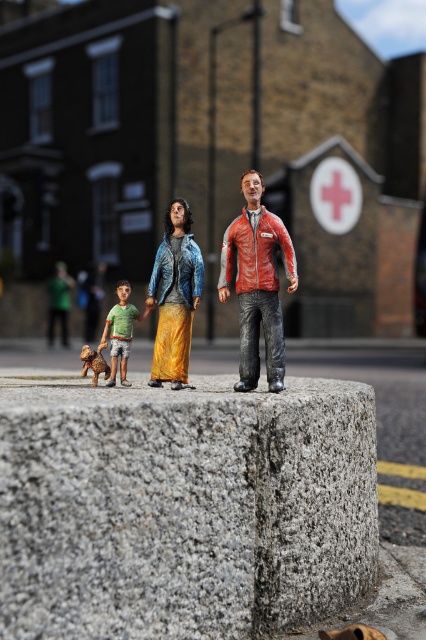
Question: Which object appears closest to the camera in this image?

Choices:
 (A) leather jacket at center
 (B) green cotton shirt at center

Answer: (A)

Question: Is leather jacket at center bigger than green cotton shirt at center?

Choices:
 (A) no
 (B) yes

Answer: (B)

Question: Does leather jacket at center have a lesser width compared to brown fur dog at lower left?

Choices:
 (A) yes
 (B) no

Answer: (B)

Question: Is green cotton shirt at center thinner than brown fur dog at lower left?

Choices:
 (A) yes
 (B) no

Answer: (B)

Question: Estimate the real-world distances between objects in this image. Which object is farther from the green cotton shirt at center?

Choices:
 (A) leather jacket at center
 (B) brown fur dog at lower left

Answer: (A)

Question: Among these points, which one is farthest from the camera?

Choices:
 (A) (115, 376)
 (B) (86, 355)

Answer: (A)